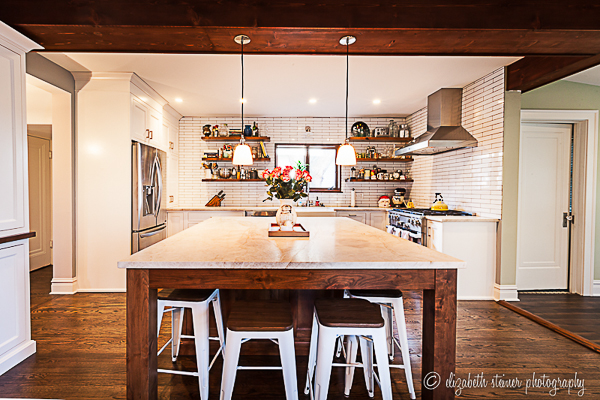
Where is `stool`? The image size is (600, 400). stool is located at coordinates (188, 298), (256, 322), (360, 321), (394, 299).